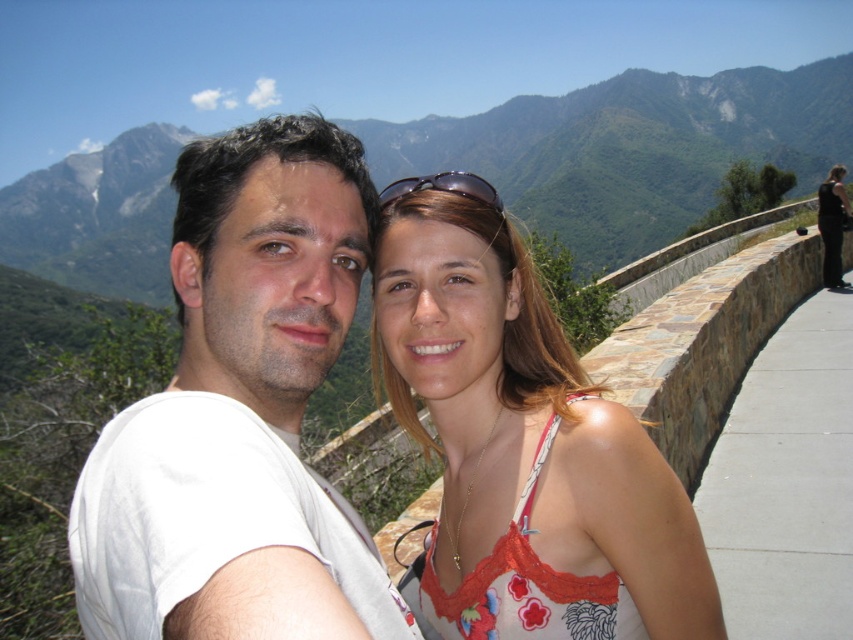
Based on the scene description, can you determine if the floral lace tank top at center is positioned above or below the green grassy mountain at upper center?

The floral lace tank top at center is below the green grassy mountain at upper center according to the description.